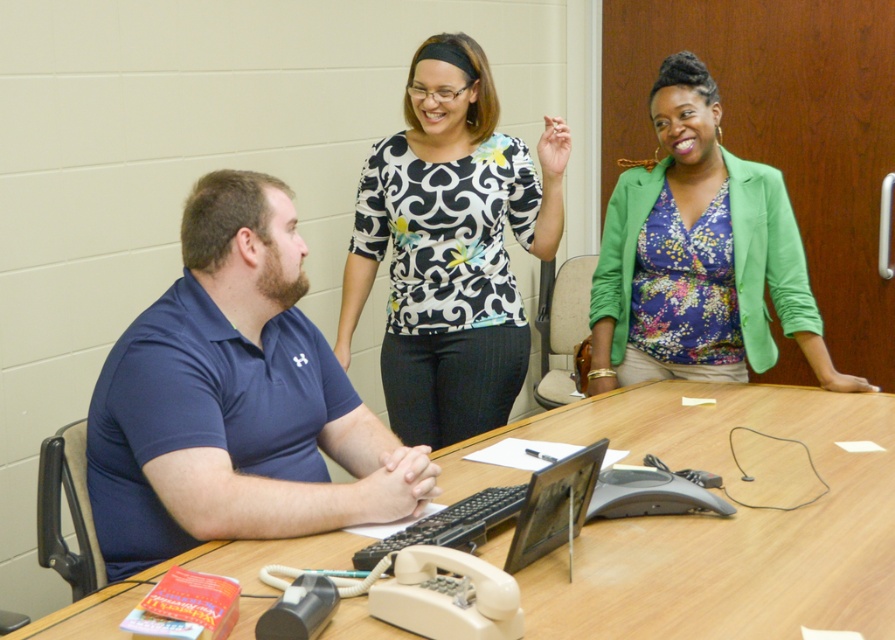
Between point (169, 490) and point (604, 276), which one is positioned behind?

The point (604, 276) is behind.

Is the position of blue cotton polo shirt at center more distant than that of floral fabric blouse at upper right?

That is False.

Between point (205, 349) and point (653, 312), which one is positioned in front?

Point (205, 349) is more forward.

Where is `blue cotton polo shirt at center`? blue cotton polo shirt at center is located at coordinates (234, 400).

This screenshot has height=640, width=895. In order to click on wooden table at center in this screenshot , I will do `click(714, 520)`.

Can you confirm if wooden table at center is taller than black and white printed blouse at center?

Incorrect, wooden table at center's height is not larger of black and white printed blouse at center's.

Is point (872, 506) closer to camera compared to point (509, 356)?

Yes, it is.

At what (x,y) coordinates should I click in order to perform the action: click on wooden table at center. Please return your answer as a coordinate pair (x, y). Looking at the image, I should click on (714, 520).

Does wooden table at center come behind floral fabric blouse at upper right?

No, wooden table at center is in front of floral fabric blouse at upper right.

How much distance is there between wooden table at center and floral fabric blouse at upper right?

wooden table at center and floral fabric blouse at upper right are 18.95 inches apart from each other.

Identify the location of wooden table at center. (714, 520).